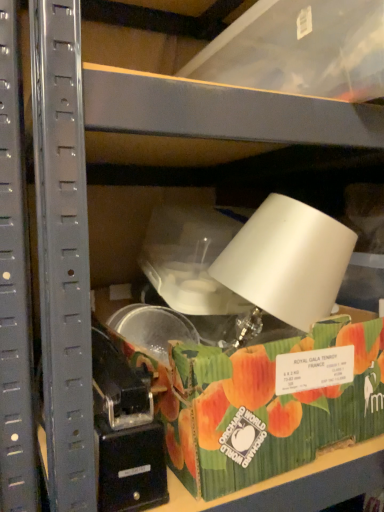
The height and width of the screenshot is (512, 384). What do you see at coordinates (266, 431) in the screenshot? I see `green corrugated cardboard box at lower center` at bounding box center [266, 431].

Where is `green corrugated cardboard box at lower center`? green corrugated cardboard box at lower center is located at coordinates (266, 431).

The height and width of the screenshot is (512, 384). I want to click on green corrugated cardboard box at lower center, so click(266, 431).